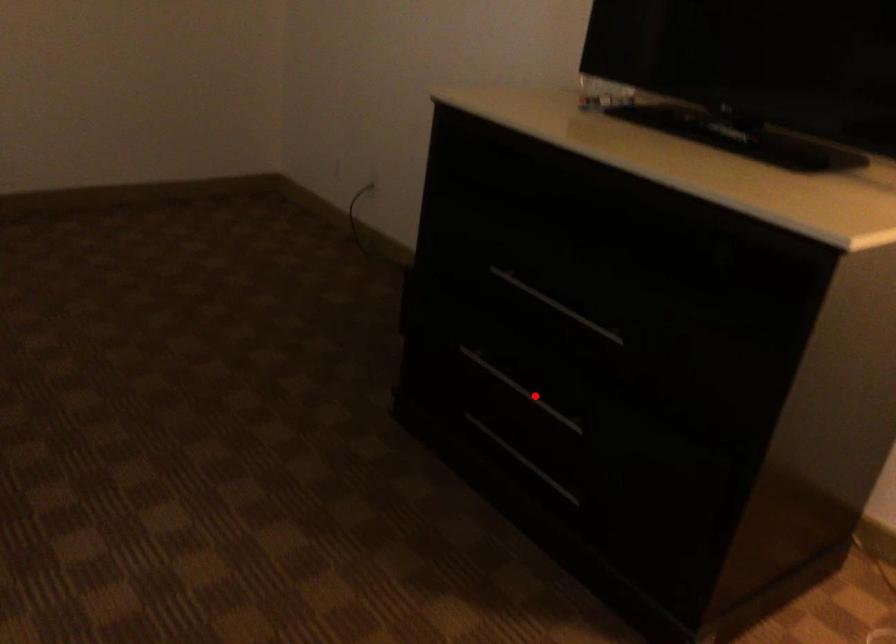
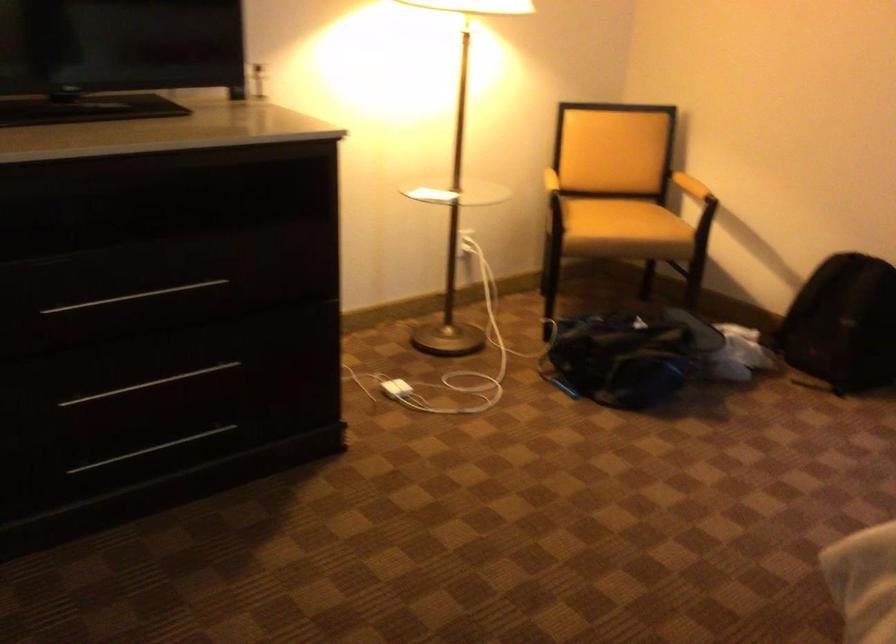
Locate, in the second image, the point that corresponds to the highlighted location in the first image.

(149, 384)